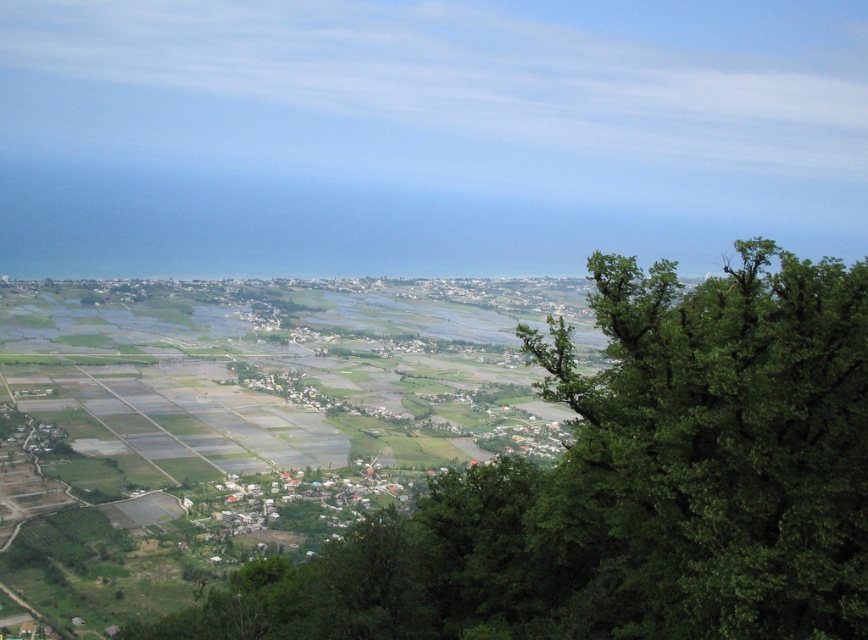
Question: Which of the following is the farthest from the observer?

Choices:
 (A) green leafy tree at center
 (B) green leafy tree at right

Answer: (A)

Question: Which object appears closest to the camera in this image?

Choices:
 (A) green leafy tree at right
 (B) green leafy tree at center

Answer: (A)

Question: Does green leafy tree at center come behind green leafy tree at right?

Choices:
 (A) no
 (B) yes

Answer: (B)

Question: Among these objects, which one is nearest to the camera?

Choices:
 (A) green leafy tree at right
 (B) green leafy tree at center

Answer: (A)

Question: From the image, what is the correct spatial relationship of green leafy tree at center in relation to green leafy tree at right?

Choices:
 (A) left
 (B) right

Answer: (A)

Question: Does green leafy tree at center appear on the right side of green leafy tree at right?

Choices:
 (A) yes
 (B) no

Answer: (B)